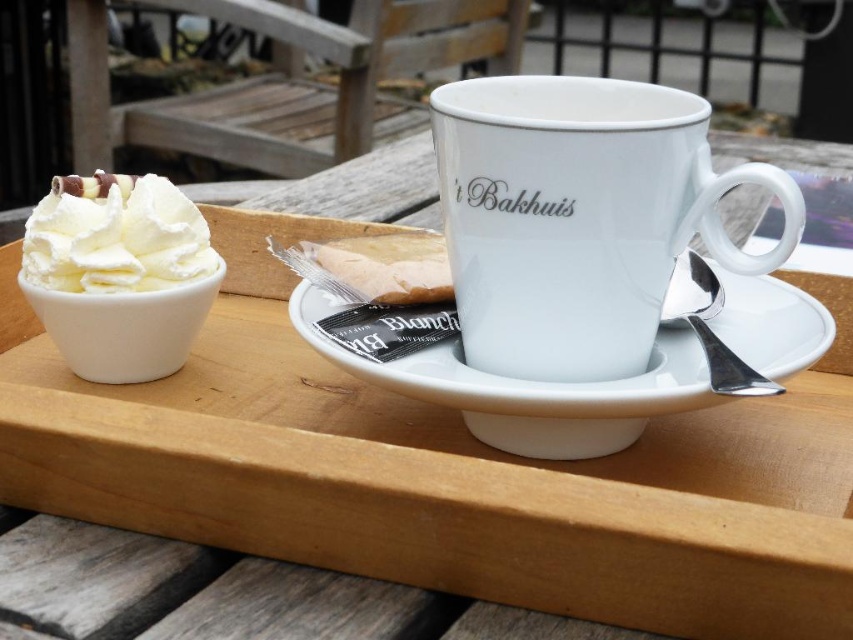
Question: Is white porcelain mug at center above whipped cream at left?

Choices:
 (A) yes
 (B) no

Answer: (A)

Question: Observing the image, what is the correct spatial positioning of white porcelain mug at center in reference to whipped cream at left?

Choices:
 (A) above
 (B) below

Answer: (A)

Question: Estimate the real-world distances between objects in this image. Which object is closer to the whipped cream at left?

Choices:
 (A) white ceramic plate at center
 (B) white porcelain mug at center

Answer: (A)

Question: Is white ceramic plate at center below smooth brownie at center?

Choices:
 (A) no
 (B) yes

Answer: (B)

Question: Based on their relative distances, which object is farther from the smooth brownie at center?

Choices:
 (A) white porcelain mug at center
 (B) white ceramic plate at center

Answer: (A)

Question: Which object is farther from the camera taking this photo?

Choices:
 (A) smooth brownie at center
 (B) white porcelain mug at center
 (C) white ceramic plate at center
 (D) whipped cream at left

Answer: (A)